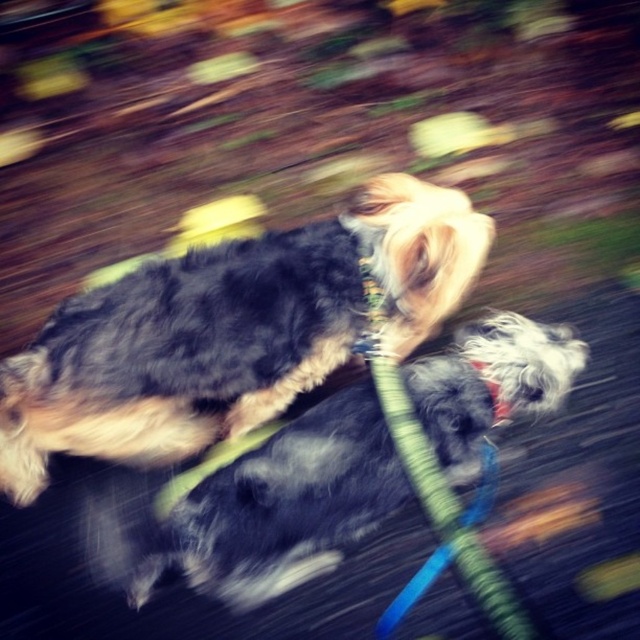
You are a photographer trying to capture a clear shot of the fluffy black dog at center and the green fabric leash at center. Based on the scene, which object is positioned higher in the image?

The fluffy black dog at center is above the green fabric leash at center in the image.

Looking at this image, you are standing at the point marked as point (x=301, y=429) and want to throw a ball to a friend who is 2 meters away from you. Can you reach your friend by throwing the ball directly? Explain using the distance between you and the point.

The distance between you and the point (x=301, y=429) is 2.07 meters. Since your friend is 2 meters away, you can throw the ball directly as the distance is slightly more than 2 meters, but within a reasonable throwing range.